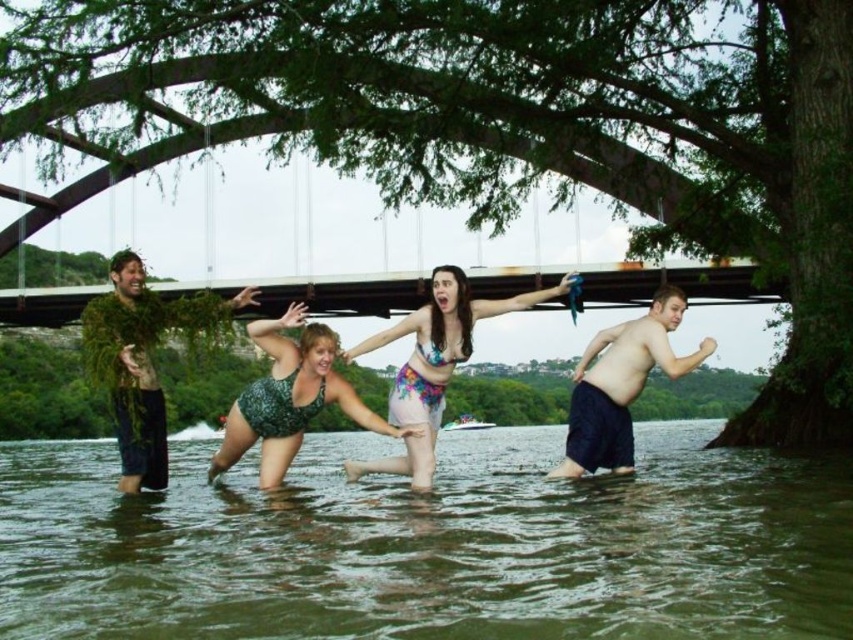
Based on the scene described, which object between the green leafy tree at center and the floral fabric bikini at center is bigger in size?

The green leafy tree at center is larger in size compared to the floral fabric bikini at center as stated in the objects description.

Based on the scene description, which object is taller between the green leafy tree at center and the greenish murky water at lower center?

The green leafy tree at center is taller than the greenish murky water at lower center according to the description.